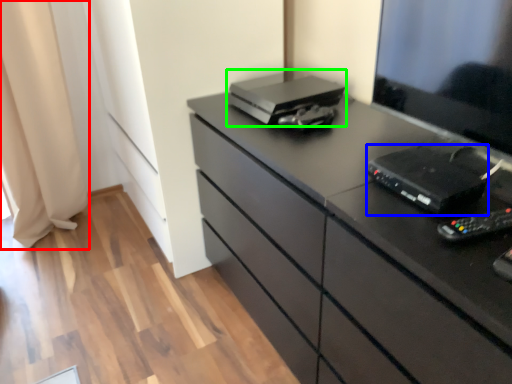
Question: Which is farther away from curtain (highlighted by a red box)? equipment (highlighted by a blue box) or printer (highlighted by a green box)?

Choices:
 (A) equipment
 (B) printer

Answer: (A)